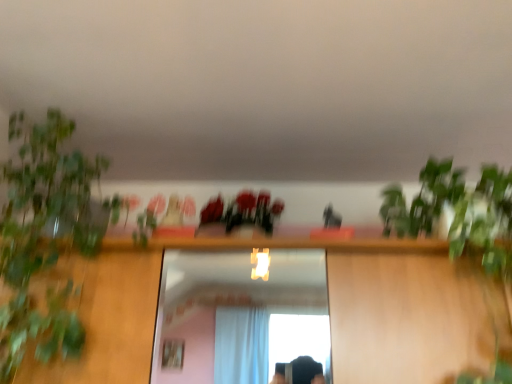
Measure the distance between matte plastic flowers at center and camera.

A distance of 4.79 feet exists between matte plastic flowers at center and camera.

Describe the element at coordinates (243, 211) in the screenshot. I see `matte plastic flowers at center` at that location.

Find the location of `matte plastic flowers at center`. matte plastic flowers at center is located at coordinates (243, 211).

Based on the photo, in order to face green leafy plant at left, should I rotate leftwards or rightwards?

Rotate your view left by about 27.541°.

Where is `green leafy plant at left`? green leafy plant at left is located at coordinates (45, 236).

What do you see at coordinates (45, 236) in the screenshot? This screenshot has width=512, height=384. I see `green leafy plant at left` at bounding box center [45, 236].

What is the approximate width of green leafy plant at left?

green leafy plant at left is 20.10 inches in width.

Locate an element on the screen. The image size is (512, 384). matte plastic flowers at center is located at coordinates (243, 211).

Would you say matte plastic flowers at center is to the left or to the right of green leafy plant at left in the picture?

matte plastic flowers at center is to the right of green leafy plant at left.

Is matte plastic flowers at center further to the viewer compared to green leafy plant at left?

Yes, matte plastic flowers at center is behind green leafy plant at left.

Considering the positions of point (268, 203) and point (73, 170), is point (268, 203) closer or farther from the camera than point (73, 170)?

Point (268, 203).

From the image's perspective, which one is positioned lower, matte plastic flowers at center or green leafy plant at left?

green leafy plant at left.

From a real-world perspective, which is physically below, matte plastic flowers at center or green leafy plant at left?

From a 3D spatial view, green leafy plant at left is below.

Considering the sizes of matte plastic flowers at center and green leafy plant at left in the image, is matte plastic flowers at center wider or thinner than green leafy plant at left?

Considering their sizes, matte plastic flowers at center looks slimmer than green leafy plant at left.

Is matte plastic flowers at center shorter than green leafy plant at left?

Yes, matte plastic flowers at center is shorter than green leafy plant at left.

Considering the relative sizes of matte plastic flowers at center and green leafy plant at left in the image provided, is matte plastic flowers at center bigger than green leafy plant at left?

No, matte plastic flowers at center is not bigger than green leafy plant at left.

Is green leafy plant at left located within matte plastic flowers at center?

Actually, green leafy plant at left is outside matte plastic flowers at center.

Is matte plastic flowers at center with green leafy plant at left?

matte plastic flowers at center and green leafy plant at left are not in contact.

Could you tell me if matte plastic flowers at center is turned towards green leafy plant at left?

No, matte plastic flowers at center is not oriented towards green leafy plant at left.

Based on the photo, how many degrees apart are the facing directions of matte plastic flowers at center and green leafy plant at left?

3.57 degrees.

Find the location of `flower that appears above the green leafy plant at left (from a real-world perspective)`. flower that appears above the green leafy plant at left (from a real-world perspective) is located at coordinates (243, 211).

From the picture: Which object is positioned more to the right, green leafy plant at left or matte plastic flowers at center?

matte plastic flowers at center.

Considering the positions of objects green leafy plant at left and matte plastic flowers at center in the image provided, who is in front, green leafy plant at left or matte plastic flowers at center?

green leafy plant at left is in front.

Is point (74, 160) closer or farther from the camera than point (233, 200)?

Point (74, 160) is closer to the camera than point (233, 200).

From the image's perspective, is green leafy plant at left over matte plastic flowers at center?

Incorrect, from the image's perspective, green leafy plant at left is lower than matte plastic flowers at center.

From a real-world perspective, is green leafy plant at left above or below matte plastic flowers at center?

green leafy plant at left is below matte plastic flowers at center.

Is green leafy plant at left thinner than matte plastic flowers at center?

In fact, green leafy plant at left might be wider than matte plastic flowers at center.

Is green leafy plant at left taller or shorter than matte plastic flowers at center?

Clearly, green leafy plant at left is taller compared to matte plastic flowers at center.

Does green leafy plant at left have a larger size compared to matte plastic flowers at center?

Correct, green leafy plant at left is larger in size than matte plastic flowers at center.

Would you say green leafy plant at left is inside or outside matte plastic flowers at center?

green leafy plant at left is not inside matte plastic flowers at center, it's outside.

Are green leafy plant at left and matte plastic flowers at center beside each other?

No.

Is green leafy plant at left looking in the opposite direction of matte plastic flowers at center?

No, matte plastic flowers at center is not at the back of green leafy plant at left.

How many degrees apart are the facing directions of green leafy plant at left and matte plastic flowers at center?

The angle between the facing direction of green leafy plant at left and the facing direction of matte plastic flowers at center is 3.57 degrees.

The height and width of the screenshot is (384, 512). What are the coordinates of `vegetation below the matte plastic flowers at center (from the image's perspective)` in the screenshot? It's located at (45, 236).

Identify the location of flower behind the green leafy plant at left. (243, 211).

I want to click on vegetation that is below the matte plastic flowers at center (from the image's perspective), so click(x=45, y=236).